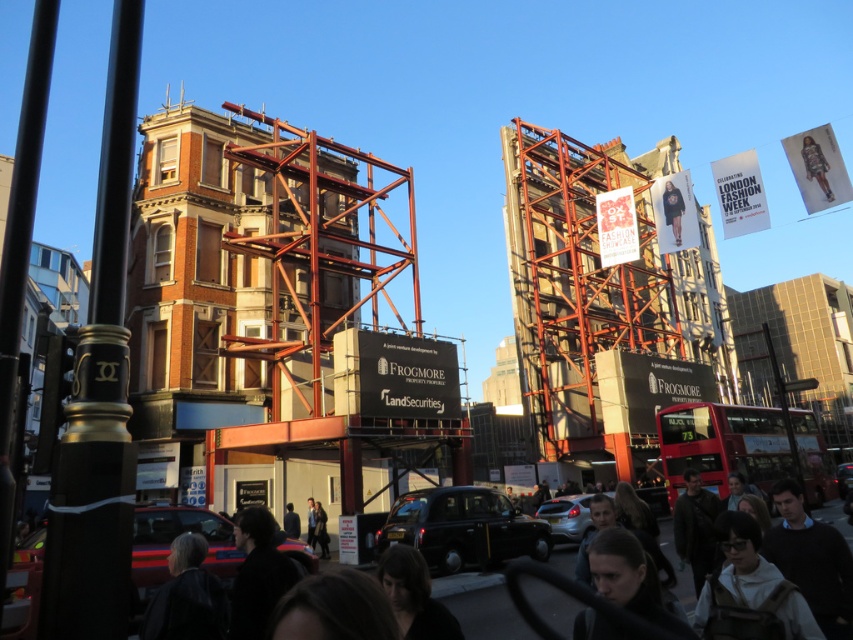
Question: Which of the following is the farthest from the observer?

Choices:
 (A) (74, 608)
 (B) (759, 481)

Answer: (B)

Question: Is red metallic bus at center closer to camera compared to dark hair at lower center?

Choices:
 (A) no
 (B) yes

Answer: (A)

Question: Is black polished metal pole at left further to camera compared to dark hair at lower center?

Choices:
 (A) yes
 (B) no

Answer: (B)

Question: Which object is the closest to the dark hair at lower center?

Choices:
 (A) black polished metal pole at left
 (B) red metallic bus at center

Answer: (B)

Question: Observing the image, what is the correct spatial positioning of black polished metal pole at left in reference to red metallic bus at center?

Choices:
 (A) left
 (B) right

Answer: (A)

Question: Which object is closer to the camera taking this photo?

Choices:
 (A) black polished metal pole at left
 (B) dark hair at lower center

Answer: (A)